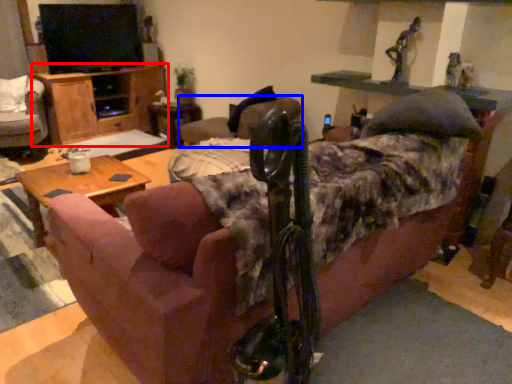
Question: Which object appears farthest to the camera in this image, dresser (highlighted by a red box) or chair (highlighted by a blue box)?

Choices:
 (A) dresser
 (B) chair

Answer: (A)